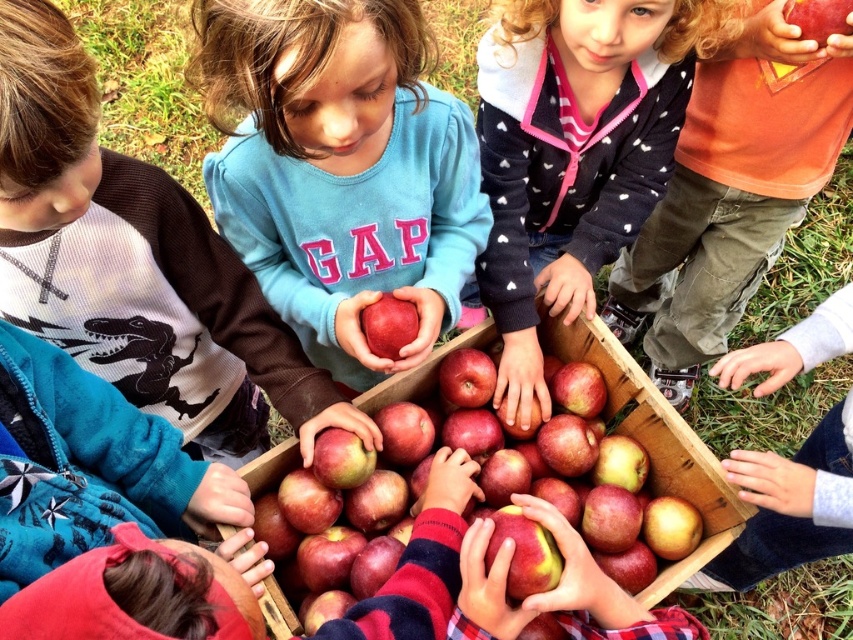
You are a photographer holding a camera. You want to take a photo of the dark blue sweater at center from a distance that ensures the sweater is in focus. The camera has a minimum focusing distance of 1.1 meters. Can you take the photo without moving closer?

The dark blue sweater at center and camera are 1.09 meters apart. Since the minimum focusing distance is 1.1 meters, the camera cannot focus on the sweater from this distance. You need to move back slightly to ensure the distance is at least 1.1 meters.

You are a photographer trying to capture a closeup of the matte blue sweater at center and the dark blue sweater at center. Since you want both sweaters to be clearly visible in the photo, which sweater should you focus on to ensure the larger one is in focus?

The matte blue sweater at center is larger in size than the dark blue sweater at center, so you should focus on the matte blue sweater at center to ensure it is in focus since it takes up more space in the frame.

You are a photographer standing at a certain distance from the matte blue sweater at center. You want to take a closeup shot of the sweater. Is the current distance sufficient for a clear closeup? Assume the minimum required distance for a clear closeup is 30 inches.

The distance between the matte blue sweater at center and the camera is 29.28 inches, which is less than the required 30 inches. Therefore, the current distance is insufficient for a clear closeup shot.